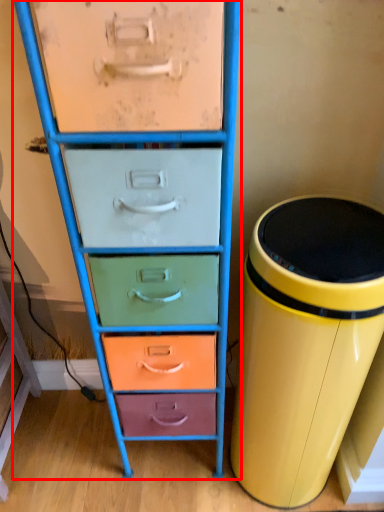
Question: Where is chest of drawers (annotated by the red box) located in relation to waste container in the image?

Choices:
 (A) left
 (B) right

Answer: (A)